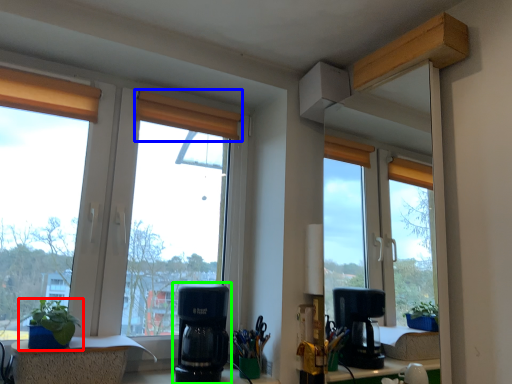
Question: Which object is positioned farthest from houseplant (highlighted by a red box)? Select from curtain (highlighted by a blue box) and coffee maker (highlighted by a green box).

Choices:
 (A) curtain
 (B) coffee maker

Answer: (A)